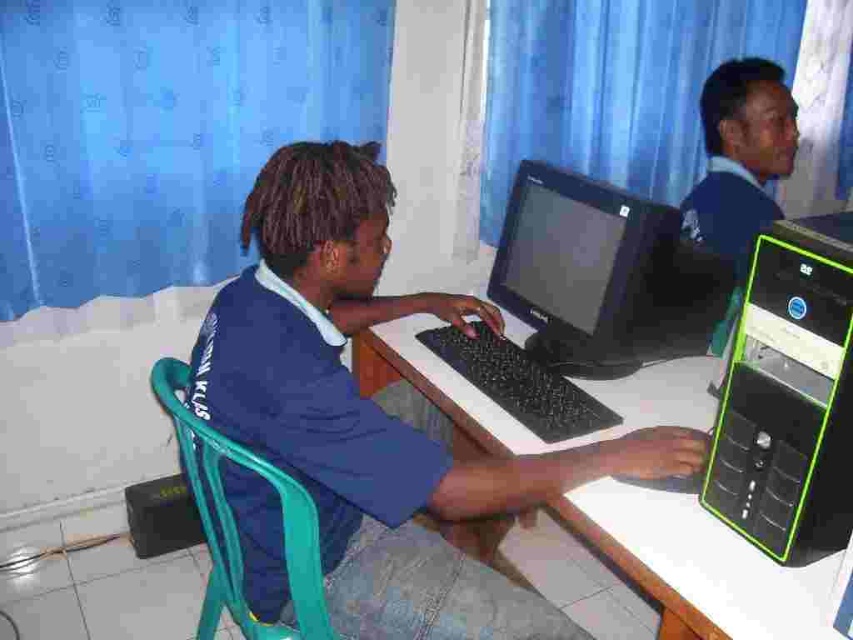
You are a technician with a 27 inch tool box. You need to place it between the black plastic computer at center and the matte black laptop at upper right. Is there enough space?

The black plastic computer at center and the matte black laptop at upper right are 27.25 inches apart, so yes, the 27 inch tool box can fit between them since the distance is slightly larger than the tool box.

You are a technician trying to fix the computer. The monitor is not turning on. You need to unplug the keyboard to access the power cable behind it. Is the black plastic monitor at center bigger than the black plastic keyboard at center?

The black plastic monitor at center has a larger size compared to the black plastic keyboard at center, so yes, the monitor is bigger than the keyboard.

You are a visitor in the room and want to see the computer screen clearly. The blue fabric shirt at center is blocking your view. Can you move the black plastic monitor at center to the right side of the desk to get a better view?

The blue fabric shirt at center is located below the black plastic monitor at center, so moving the monitor to the right side of the desk would allow you to see the screen clearly without obstruction from the shirt.